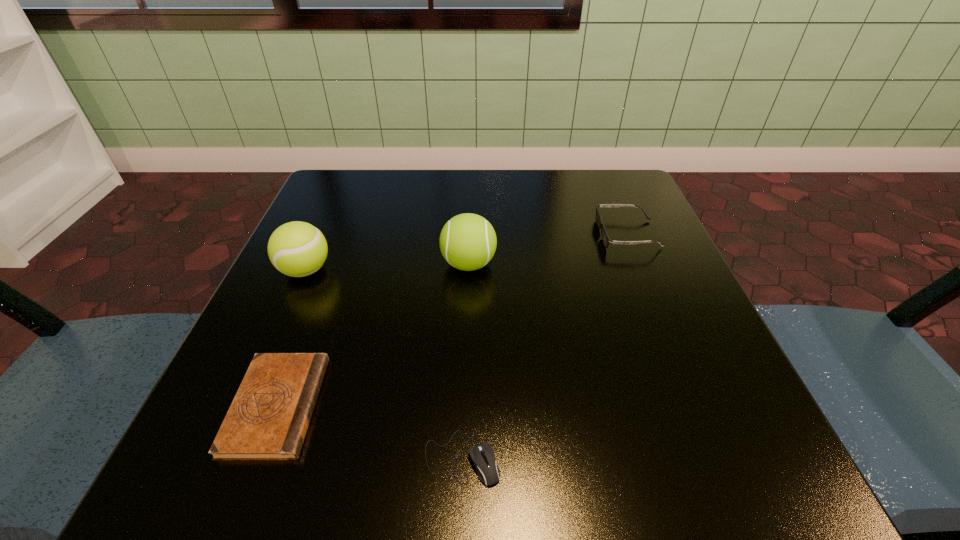
I want to click on the right tennis ball, so click(x=468, y=242).

Locate an element on the screen. This screenshot has width=960, height=540. the left tennis ball is located at coordinates (297, 249).

This screenshot has height=540, width=960. What are the coordinates of `the rightmost object` in the screenshot? It's located at (606, 240).

Identify the location of sunglasses. Image resolution: width=960 pixels, height=540 pixels. (606, 240).

What are the coordinates of `computer mouse` in the screenshot? It's located at (482, 455).

What are the coordinates of `diary` in the screenshot? It's located at (269, 416).

Locate an element on the screen. This screenshot has width=960, height=540. free spot located 0.200m on the right of the right tennis ball is located at coordinates (604, 264).

You are a GUI agent. You are given a task and a screenshot of the screen. Output one action in this format:
    pyautogui.click(x=<x>, y=<y>)
    Task: Click on the vacant region located 0.110m on the back of the left tennis ball
    
    Given the screenshot: What is the action you would take?
    pyautogui.click(x=327, y=220)

Locate an element on the screen. vacant area located 0.340m on the front-facing side of the sunglasses is located at coordinates (430, 234).

Identify the location of blank space located 0.060m on the front-facing side of the sunglasses. (568, 234).